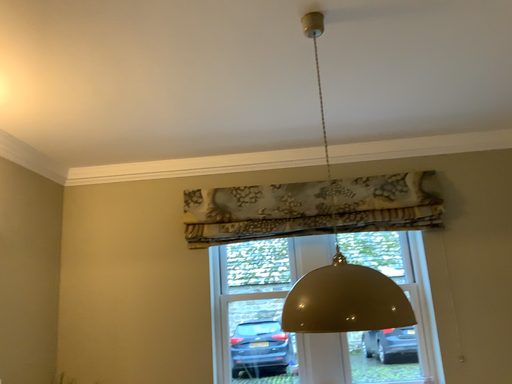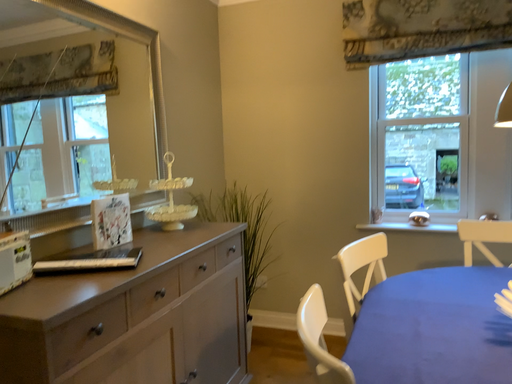
Question: Which way did the camera rotate in the video?

Choices:
 (A) rotated downward
 (B) rotated upward

Answer: (A)